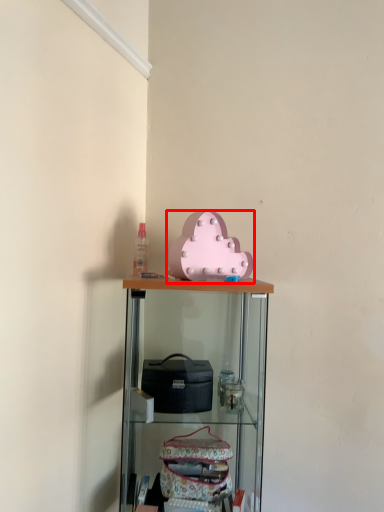
Question: Observing the image, what is the correct spatial positioning of toy (annotated by the red box) in reference to shelf?

Choices:
 (A) right
 (B) left

Answer: (A)